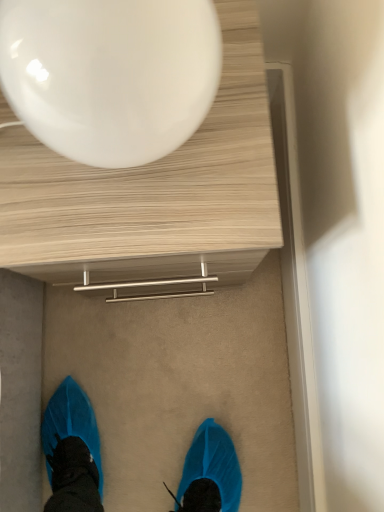
In order to click on vacant region in front of glossy white balloon at upper center in this screenshot , I will do `click(139, 226)`.